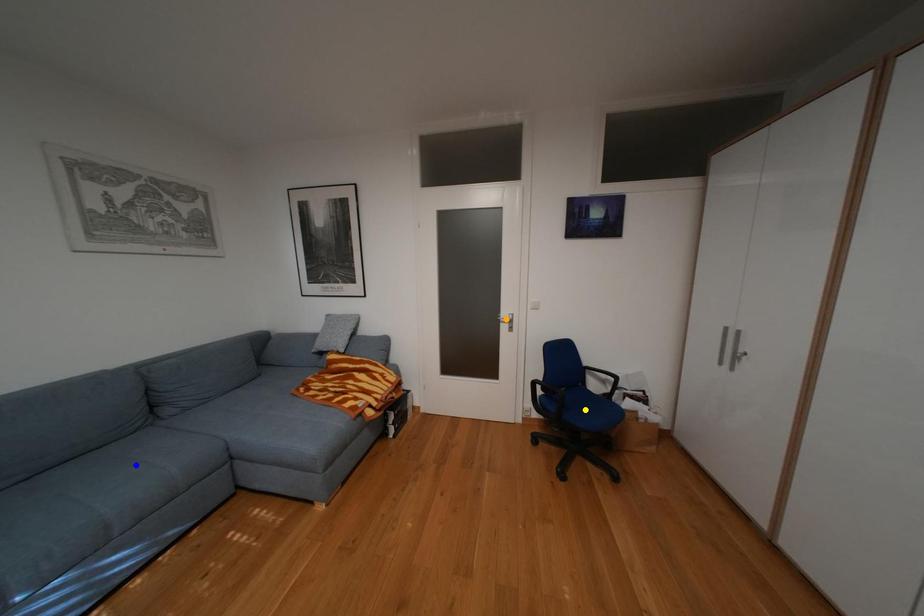
From the picture: Order these from farthest to nearest:
A) orange point
B) yellow point
C) blue point

1. orange point
2. yellow point
3. blue point